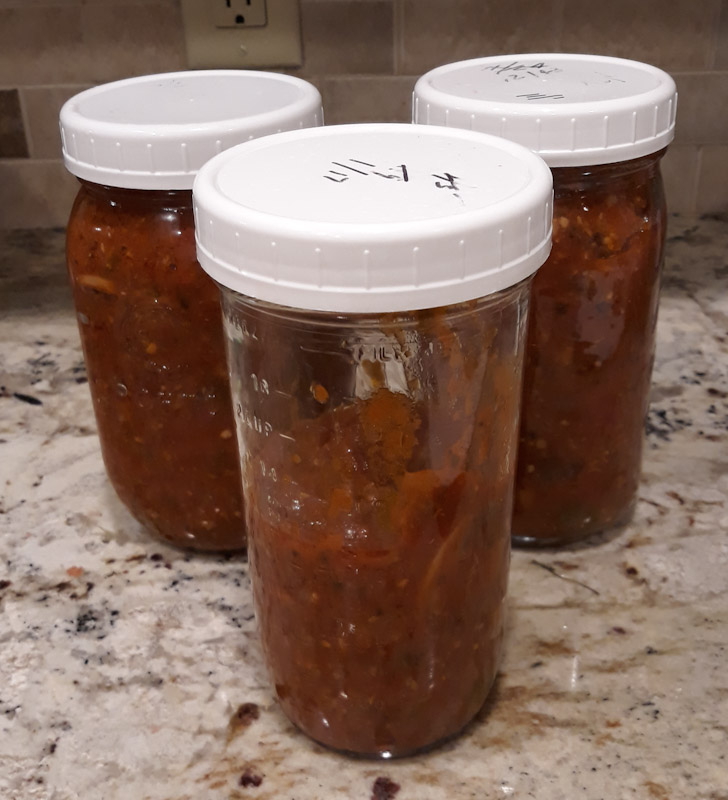
Locate an element on the screen. Image resolution: width=728 pixels, height=800 pixels. marbled look counter top is located at coordinates (138, 718).